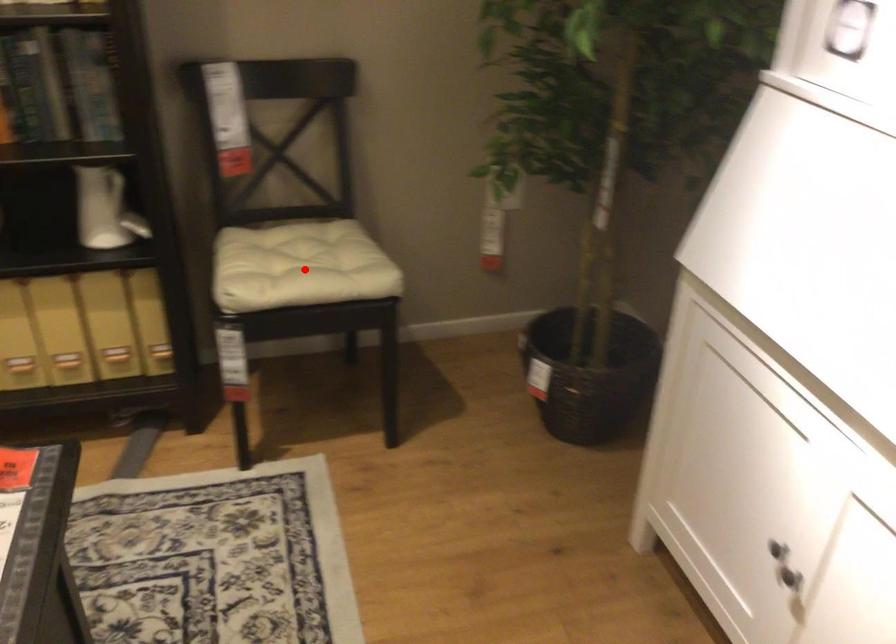
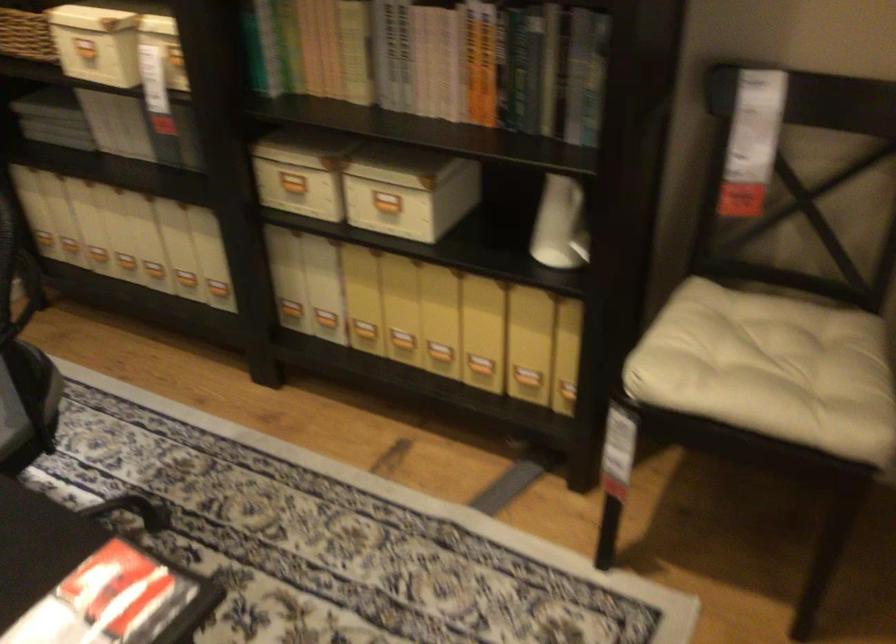
Where in the second image is the point corresponding to the highlighted location from the first image?

(776, 366)